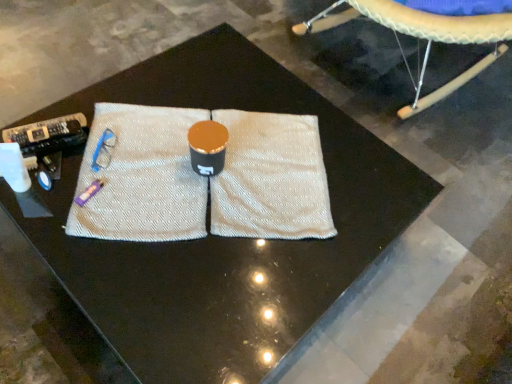
Locate an element on the screen. vacant space underneath white textured yoga mat at center (from a real-world perspective) is located at coordinates (143, 172).